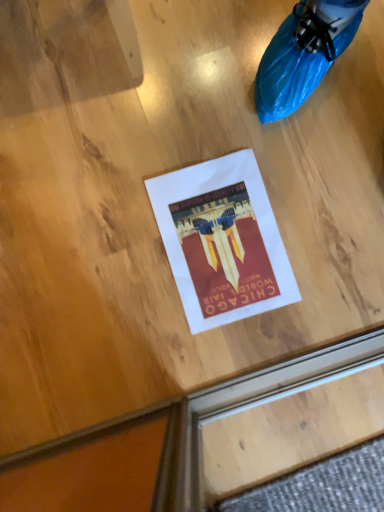
At what (x,y) coordinates should I click in order to perform the action: click on empty space that is ontop of white paper flyer at center (from a real-world perspective). Please return your answer as a coordinate pair (x, y). This screenshot has height=512, width=384. Looking at the image, I should click on (229, 240).